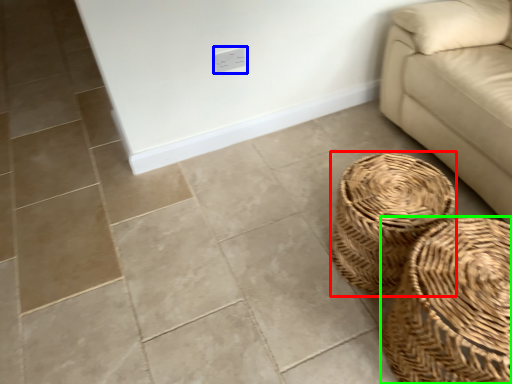
Question: Estimate the real-world distances between objects in this image. Which object is closer to basket (highlighted by a red box), electric outlet (highlighted by a blue box) or basket (highlighted by a green box)?

Choices:
 (A) electric outlet
 (B) basket

Answer: (B)